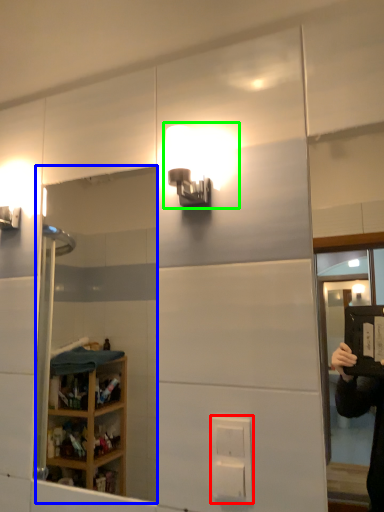
Question: Estimate the real-world distances between objects in this image. Which object is closer to electric outlet (highlighted by a red box), mirror (highlighted by a blue box) or light fixture (highlighted by a green box)?

Choices:
 (A) mirror
 (B) light fixture

Answer: (B)